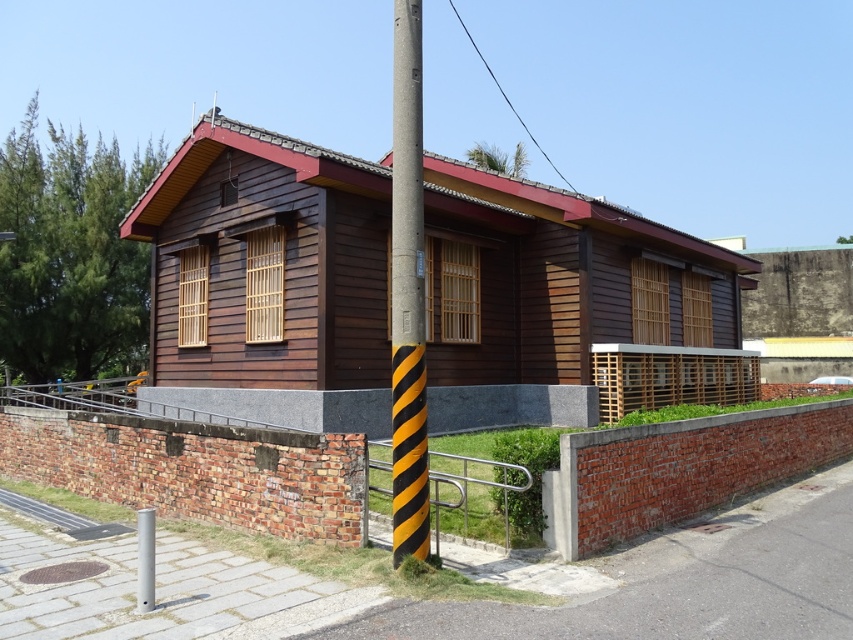
Question: Is yellow-black striped pole at center to the right of white plastic street sign at upper center from the viewer's perspective?

Choices:
 (A) no
 (B) yes

Answer: (B)

Question: Does yellow-black striped pole at center have a larger size compared to white plastic street sign at upper center?

Choices:
 (A) yes
 (B) no

Answer: (A)

Question: Which point is farther to the camera?

Choices:
 (A) yellow-black striped pole at center
 (B) white plastic street sign at upper center

Answer: (B)

Question: In this image, where is yellow-black striped pole at center located relative to white plastic street sign at upper center?

Choices:
 (A) above
 (B) below

Answer: (B)